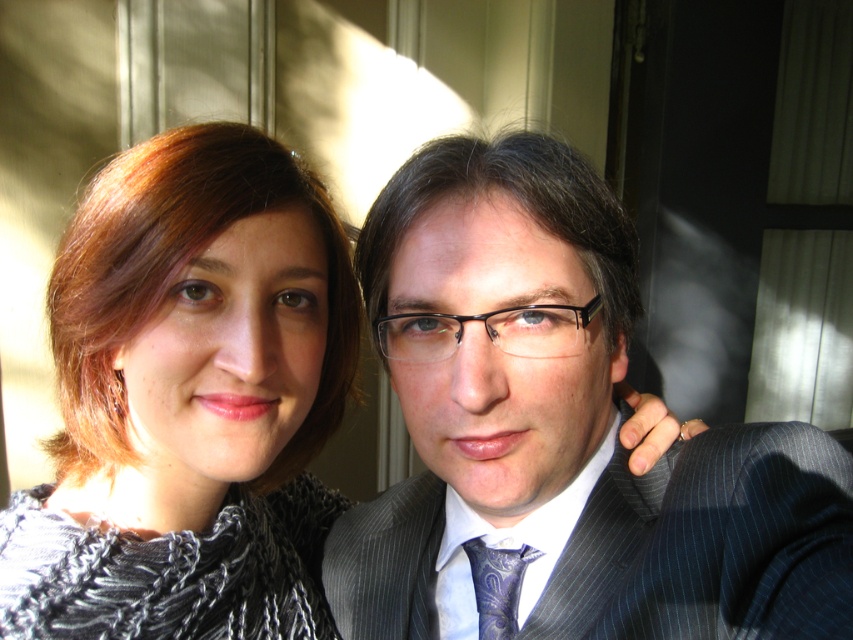
Is dark gray pinstripe suit at center below paisley silk tie at center?

No, dark gray pinstripe suit at center is not below paisley silk tie at center.

Describe the element at coordinates (561, 429) in the screenshot. I see `dark gray pinstripe suit at center` at that location.

At what (x,y) coordinates should I click in order to perform the action: click on dark gray pinstripe suit at center. Please return your answer as a coordinate pair (x, y). Looking at the image, I should click on (561, 429).

In the scene shown: Which is below, knitted gray sweater at left or pinstriped fabric suit at center?

Positioned lower is pinstriped fabric suit at center.

Is point (293, 262) positioned behind point (746, 449)?

That is True.

Describe the element at coordinates (189, 401) in the screenshot. I see `knitted gray sweater at left` at that location.

The image size is (853, 640). I want to click on knitted gray sweater at left, so click(x=189, y=401).

Who is taller, knitted gray sweater at left or paisley silk tie at center?

knitted gray sweater at left

The height and width of the screenshot is (640, 853). What do you see at coordinates (189, 401) in the screenshot? I see `knitted gray sweater at left` at bounding box center [189, 401].

Where is `knitted gray sweater at left`? knitted gray sweater at left is located at coordinates (189, 401).